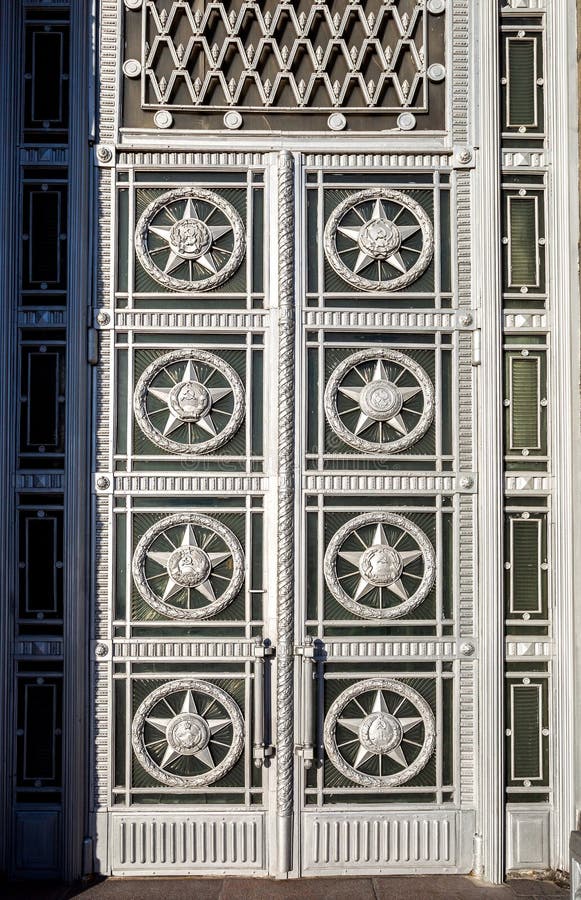
The image size is (581, 900). In order to click on bottom left hinge in this screenshot , I will do `click(89, 859)`.